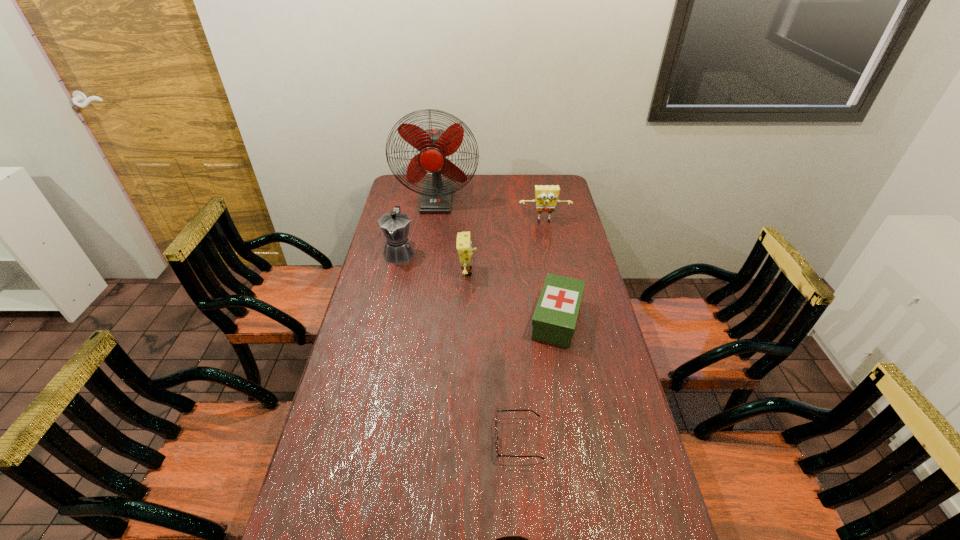
This screenshot has height=540, width=960. I want to click on the farthest object, so click(x=434, y=145).

This screenshot has width=960, height=540. What are the coordinates of `the tallest object` in the screenshot? It's located at (434, 145).

Where is `coffeepot`? coffeepot is located at coordinates (395, 225).

Where is `the sixth nearest object`? the sixth nearest object is located at coordinates (546, 197).

This screenshot has width=960, height=540. I want to click on the farther sponge, so click(x=546, y=197).

What are the coordinates of `the nearer sponge` in the screenshot? It's located at (465, 251).

You are a GUI agent. You are given a task and a screenshot of the screen. Output one action in this format:
    pyautogui.click(x=<x>, y=<y>)
    Task: Click on the third nearest object
    The image size is (960, 540).
    Given the screenshot: What is the action you would take?
    pyautogui.click(x=554, y=320)

Locate an element on the screen. the second nearest object is located at coordinates (497, 453).

The image size is (960, 540). In order to click on the shortest object in this screenshot , I will do `click(497, 453)`.

This screenshot has width=960, height=540. In order to click on blank area located on the front-facing side of the fan in this screenshot , I will do `click(429, 257)`.